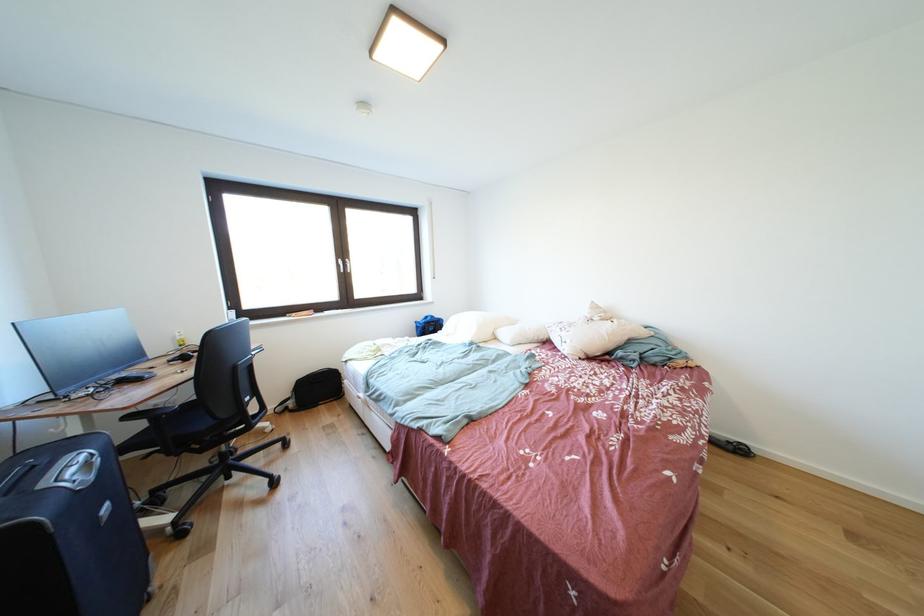
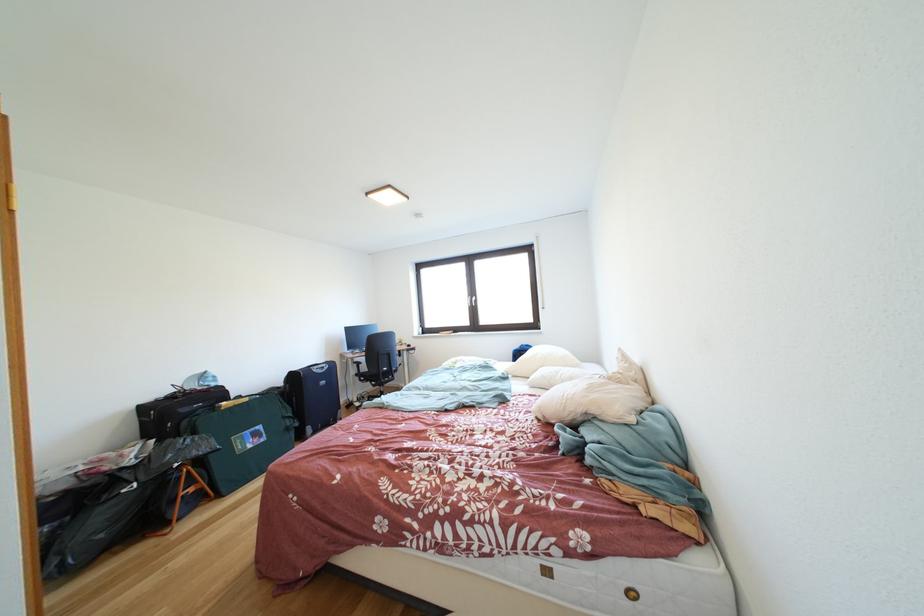
Find the pixel in the second image that matches point (210, 455) in the first image.

(383, 391)